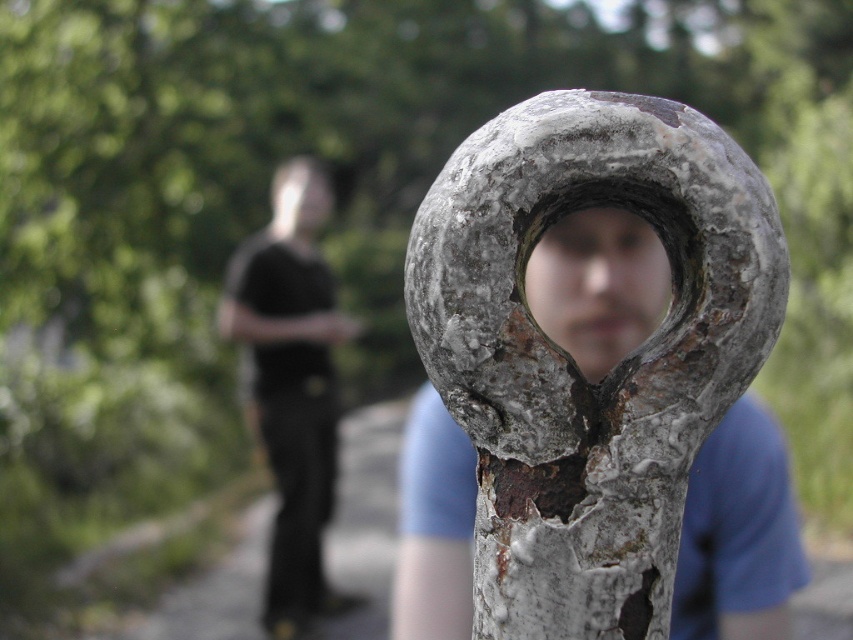
Does rusty metal heart at center lie behind rusty metal hole at center?

No.

Is rusty metal heart at center to the right of rusty metal hole at center from the viewer's perspective?

Incorrect, rusty metal heart at center is not on the right side of rusty metal hole at center.

Does point (428, 458) come farther from viewer compared to point (625, 269)?

Yes, it is.

Where is `rusty metal heart at center`? rusty metal heart at center is located at coordinates (738, 532).

Is rusty metal heart at center above black matte shirt at center?

Indeed, rusty metal heart at center is positioned over black matte shirt at center.

Is rusty metal heart at center positioned before black matte shirt at center?

Yes, it is in front of black matte shirt at center.

Describe the element at coordinates (738, 532) in the screenshot. I see `rusty metal heart at center` at that location.

You are a GUI agent. You are given a task and a screenshot of the screen. Output one action in this format:
    pyautogui.click(x=<x>, y=<y>)
    Task: Click on the rusty metal heart at center
    
    Given the screenshot: What is the action you would take?
    coord(738,532)

Between point (292, 611) and point (598, 296), which one is positioned behind?

Positioned behind is point (292, 611).

Between black matte shirt at center and rusty metal hole at center, which one has more height?

black matte shirt at center is taller.

Where is `black matte shirt at center`? black matte shirt at center is located at coordinates (292, 385).